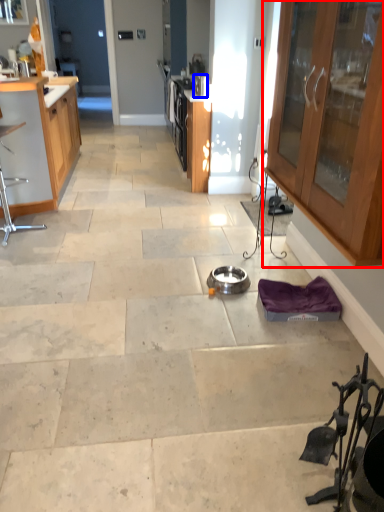
Question: Which object appears farthest to the camera in this image, cabinetry (highlighted by a red box) or appliance (highlighted by a blue box)?

Choices:
 (A) cabinetry
 (B) appliance

Answer: (B)